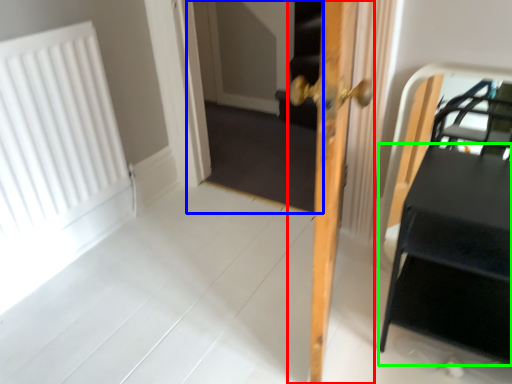
Question: Which object is positioned farthest from door (highlighted by a red box)? Select from screen door (highlighted by a blue box) and table (highlighted by a green box).

Choices:
 (A) screen door
 (B) table

Answer: (A)